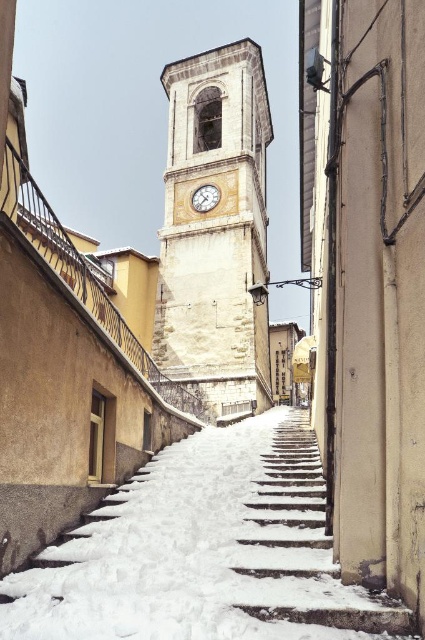
You are a tourist visiting the town and want to take a photo of the white stone clock tower at center. However, you notice the white powdery snow at center might block your view. Is the snow in front of or behind the clock tower?

The white powdery snow at center is located below white stone clock tower at center, so the snow is behind the clock tower and won

You are a painter wanting to capture the winter scene in front of you. You notice the white stone clock tower at center and the wooden clock at center. Which object should you focus on if you want to paint the wider structure?

The white stone clock tower at center might be wider than wooden clock at center, so you should focus on painting the white stone clock tower at center.